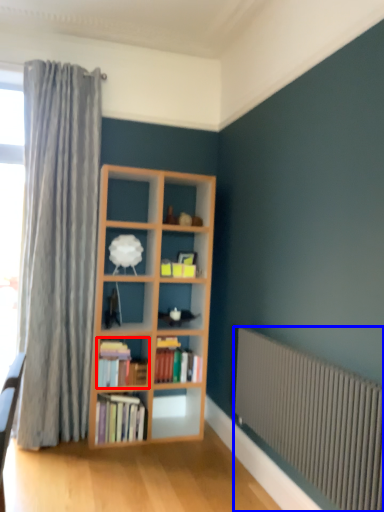
Question: Which object is closer to the camera taking this photo, book (highlighted by a red box) or radiator (highlighted by a blue box)?

Choices:
 (A) book
 (B) radiator

Answer: (B)